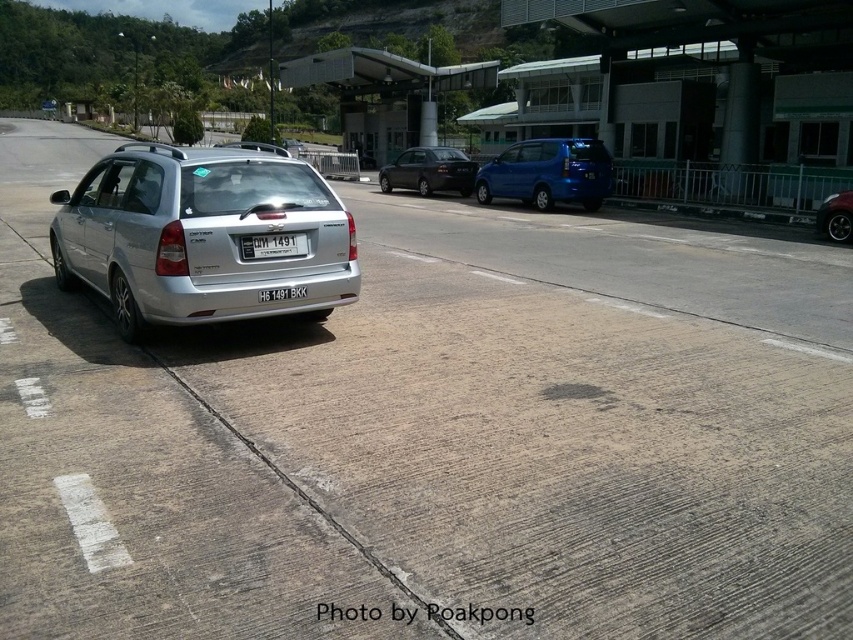
You are a delivery driver who needs to park your 5.5 meter long truck between the glossy blue minivan at center and the gray concrete curb at lower center. Can you fit your truck in that space without overlapping either vehicle or the curb?

The glossy blue minivan at center and gray concrete curb at lower center are 6.02 meters apart. Since your truck is 5.5 meters long, it can fit in the space as 5.5 meters is less than 6.02 meters. However, you must ensure proper alignment to avoid overlapping either the minivan or the curb.

You are a traffic officer at the checkpoint. You need to record the license plate of the silver metallic hatchback at left. Based on its position, where should you look to find the license plate?

The license plate of the silver metallic hatchback at left is located at the rear of the vehicle, which is positioned at point (201, 236). To find it, look at the back side of the silver metallic hatchback at left.